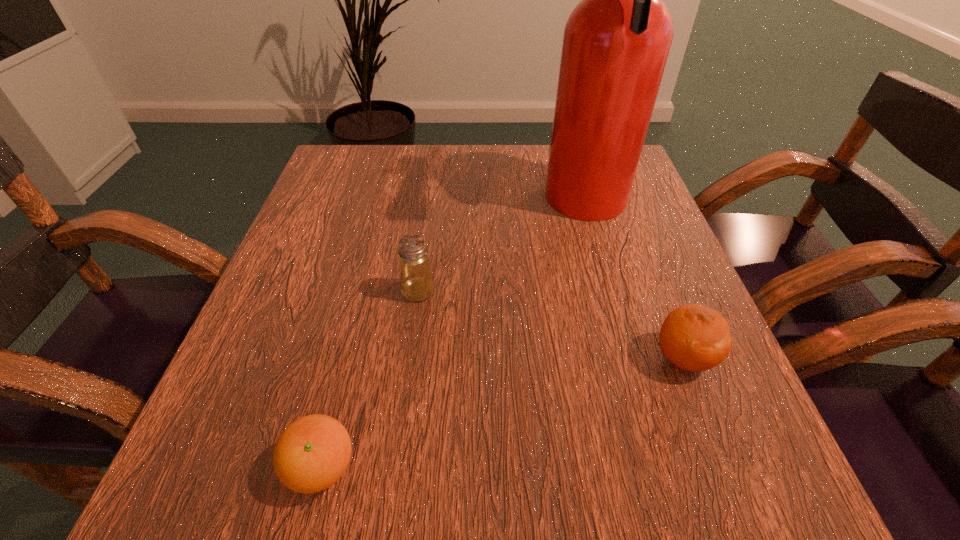
At what (x,y) coordinates should I click in order to perform the action: click on vacant space located on the left of the taller orange. Please return your answer as a coordinate pair (x, y). Looking at the image, I should click on (x=587, y=358).

At what (x,y) coordinates should I click in order to perform the action: click on vacant region located on the right of the shorter orange. Please return your answer as a coordinate pair (x, y). The image size is (960, 540). Looking at the image, I should click on (443, 467).

Locate an element on the screen. This screenshot has height=540, width=960. object that is at the far edge is located at coordinates (616, 42).

This screenshot has height=540, width=960. What are the coordinates of `object present at the near edge` in the screenshot? It's located at (312, 453).

Image resolution: width=960 pixels, height=540 pixels. I want to click on object at the left edge, so click(x=312, y=453).

Where is `fire extinguisher located at the right edge`? Image resolution: width=960 pixels, height=540 pixels. fire extinguisher located at the right edge is located at coordinates (616, 42).

Locate an element on the screen. The height and width of the screenshot is (540, 960). orange located at the right edge is located at coordinates (695, 338).

Locate an element on the screen. object positioned at the near left corner is located at coordinates (312, 453).

Find the location of a particular element. This screenshot has width=960, height=540. object positioned at the far right corner is located at coordinates (616, 42).

Where is `vacant space at the far edge of the desktop`? The width and height of the screenshot is (960, 540). vacant space at the far edge of the desktop is located at coordinates (490, 170).